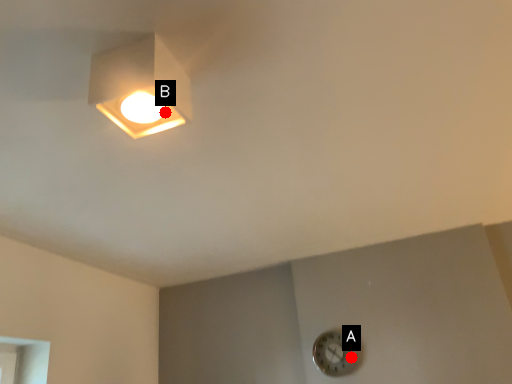
Question: Two points are circled on the image, labeled by A and B beside each circle. Which point appears farthest from the camera in this image?

Choices:
 (A) A is further
 (B) B is further

Answer: (A)